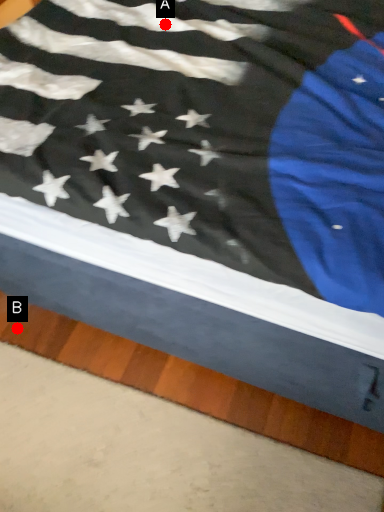
Question: Two points are circled on the image, labeled by A and B beside each circle. Which of the following is the closest to the observer?

Choices:
 (A) A is closer
 (B) B is closer

Answer: (A)